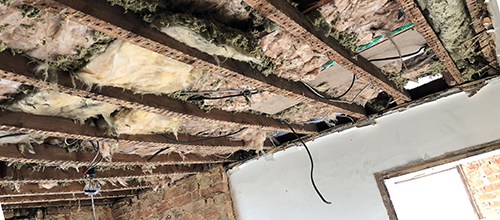
Find the location of a particular element. brick wall is located at coordinates (185, 200), (98, 212).